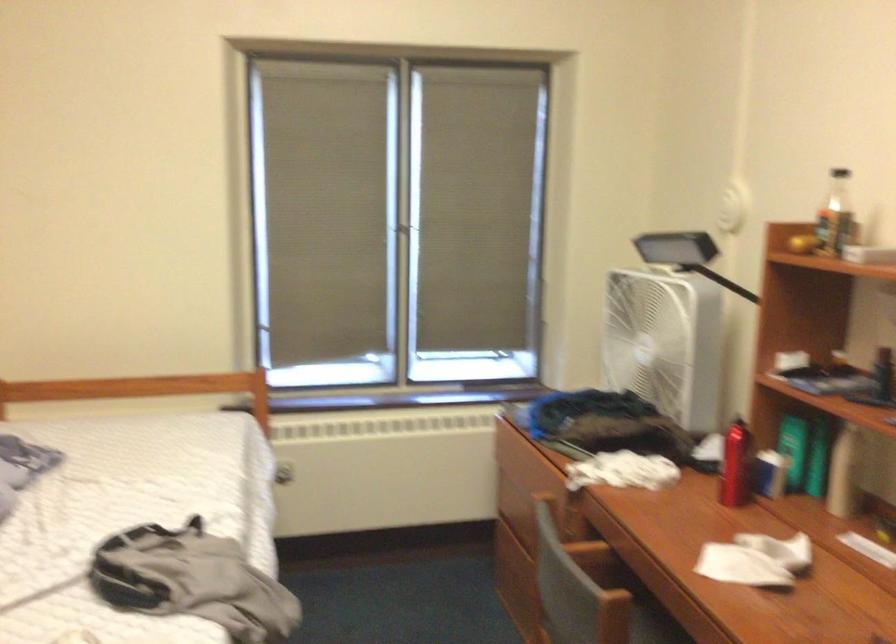
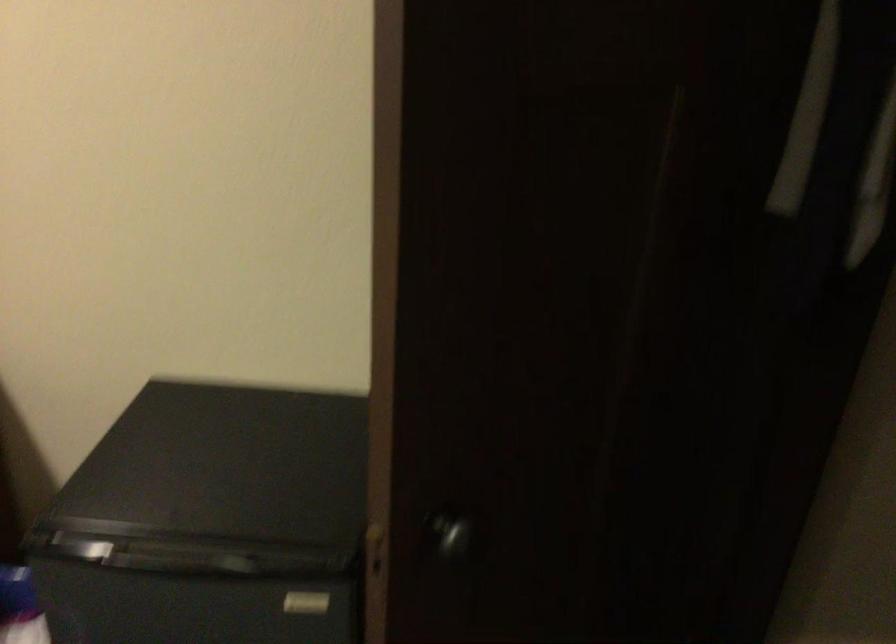
The first image is from the beginning of the video and the second image is from the end. How did the camera likely rotate when shooting the video?

The camera rotated toward right-down.